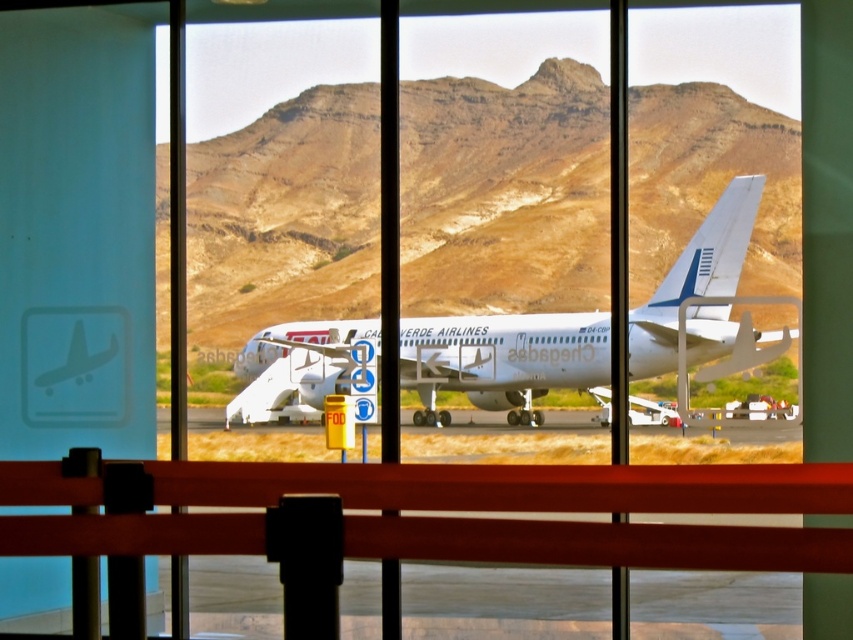
The image size is (853, 640). What do you see at coordinates (505, 193) in the screenshot? I see `brown rocky mountain at center` at bounding box center [505, 193].

Can you confirm if brown rocky mountain at center is bigger than metallic red rail at center?

Correct, brown rocky mountain at center is larger in size than metallic red rail at center.

Where is `brown rocky mountain at center`? The height and width of the screenshot is (640, 853). brown rocky mountain at center is located at coordinates (505, 193).

Which is behind, point (656, 92) or point (680, 280)?

Positioned behind is point (656, 92).

Is brown rocky mountain at center to the right of white glossy airplane at center from the viewer's perspective?

Incorrect, brown rocky mountain at center is not on the right side of white glossy airplane at center.

Find the location of a particular element. The height and width of the screenshot is (640, 853). brown rocky mountain at center is located at coordinates (505, 193).

Does metallic red rail at center appear under white glossy airplane at center?

Yes, metallic red rail at center is below white glossy airplane at center.

Can you confirm if metallic red rail at center is wider than white glossy airplane at center?

No, metallic red rail at center is not wider than white glossy airplane at center.

The width and height of the screenshot is (853, 640). Identify the location of metallic red rail at center. (404, 524).